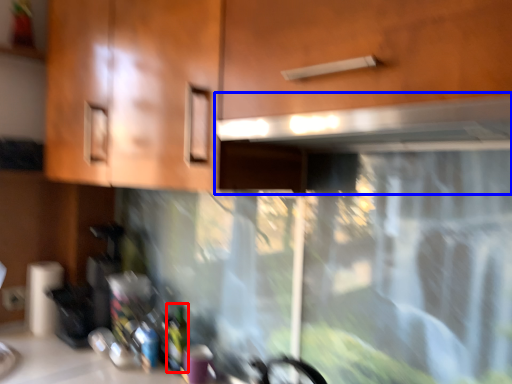
Question: Which of the following is the farthest to the observer, bottle (highlighted by a red box) or exhaust hood (highlighted by a blue box)?

Choices:
 (A) bottle
 (B) exhaust hood

Answer: (A)